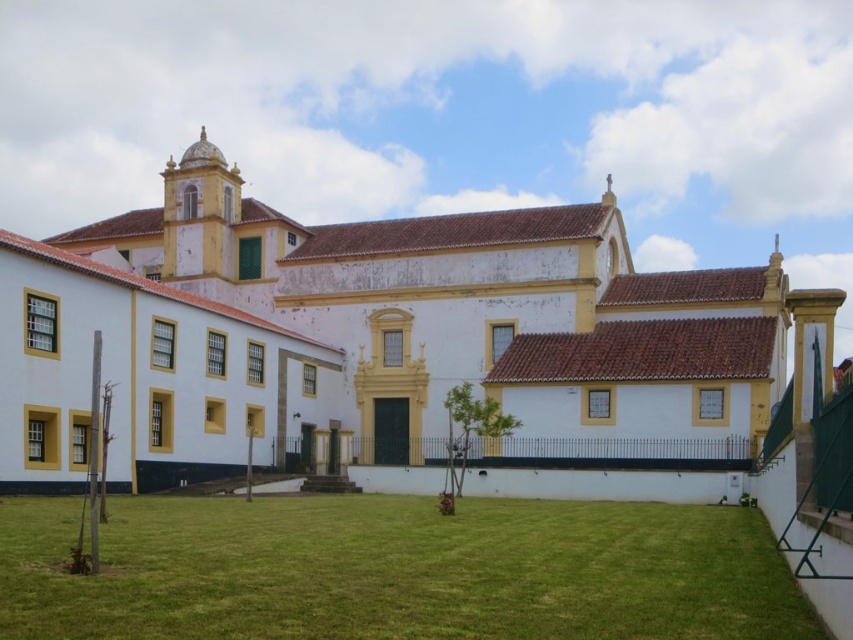
Between point (595, 282) and point (274, 518), which one is positioned in front?

Positioned in front is point (274, 518).

Which is above, white matte building at center or green grass at lower center?

white matte building at center is higher up.

Image resolution: width=853 pixels, height=640 pixels. Describe the element at coordinates (366, 337) in the screenshot. I see `white matte building at center` at that location.

The height and width of the screenshot is (640, 853). Identify the location of white matte building at center. (366, 337).